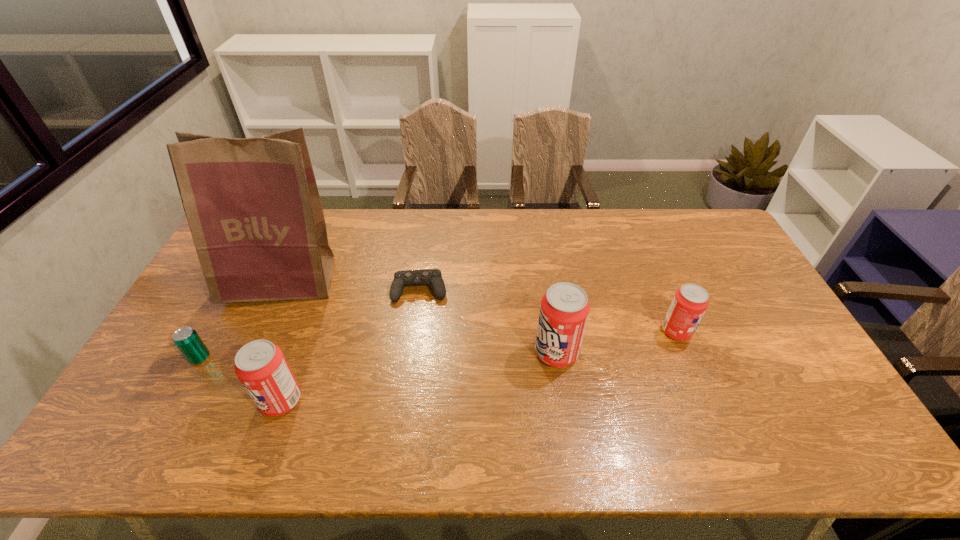
Please mark a free spot for a new pop_(soda) to balance the arrangement. Please provide its 2D coordinates. Your answer should be formatted as a tuple, i.e. [(x, y)], where the tuple contains the x and y coordinates of a point satisfying the conditions above.

[(425, 375)]